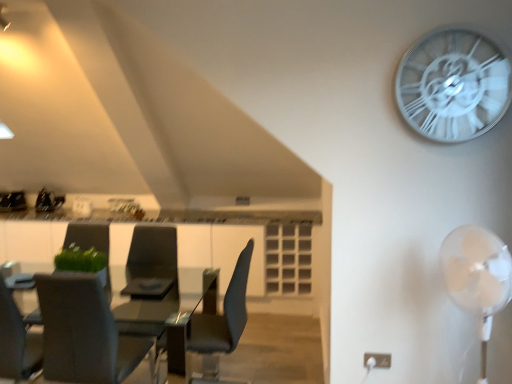
What do you see at coordinates (91, 242) in the screenshot?
I see `green fabric armchair at left, which appears as the 2th armchair when viewed from the right` at bounding box center [91, 242].

Describe the element at coordinates (221, 324) in the screenshot. The image size is (512, 384). I see `matte black chair at center, arranged as the first chair when viewed from the right` at that location.

This screenshot has width=512, height=384. Describe the element at coordinates (150, 278) in the screenshot. I see `matte black armchair at center, positioned as the first armchair in right-to-left order` at that location.

This screenshot has width=512, height=384. Describe the element at coordinates (84, 332) in the screenshot. I see `matte gray chair at left, which appears as the first chair when viewed from the left` at that location.

Find the location of a particular element. The width and height of the screenshot is (512, 384). green fabric armchair at left, which appears as the 2th armchair when viewed from the right is located at coordinates (91, 242).

Do you think white metallic clock at upper right is within matte gray chair at left, which appears as the first chair when viewed from the left, or outside of it?

white metallic clock at upper right cannot be found inside matte gray chair at left, which appears as the first chair when viewed from the left.

Does point (452, 62) come farther from viewer compared to point (116, 373)?

No, (452, 62) is in front of (116, 373).

Would you say white metallic clock at upper right is to the left or to the right of matte gray chair at left, the 2th chair in the right-to-left sequence, in the picture?

From the image, it's evident that white metallic clock at upper right is to the right of matte gray chair at left, the 2th chair in the right-to-left sequence.

Which of these two, white metallic clock at upper right or matte gray chair at left, the 2th chair in the right-to-left sequence, is thinner?

Thinner between the two is white metallic clock at upper right.

Is green fabric armchair at left, which appears as the 2th armchair when viewed from the right, far from matte black armchair at center, positioned as the first armchair in right-to-left order?

green fabric armchair at left, which appears as the 2th armchair when viewed from the right, is near matte black armchair at center, positioned as the first armchair in right-to-left order, not far away.

Is green fabric armchair at left, which appears as the 2th armchair when viewed from the right, outside of matte black armchair at center, positioned as the first armchair in right-to-left order?

Absolutely, green fabric armchair at left, which appears as the 2th armchair when viewed from the right, is external to matte black armchair at center, positioned as the first armchair in right-to-left order.

Which is more to the left, green fabric armchair at left, which appears as the 2th armchair when viewed from the right, or matte black armchair at center, which is the 2th armchair from left to right?

green fabric armchair at left, which appears as the 2th armchair when viewed from the right, is more to the left.

Which of these two, matte black chair at center, arranged as the first chair when viewed from the right, or green fabric armchair at left, which appears as the 2th armchair when viewed from the right, is thinner?

green fabric armchair at left, which appears as the 2th armchair when viewed from the right, is thinner.

From their relative heights in the image, would you say matte black chair at center, marked as the second chair in a left-to-right arrangement, is taller or shorter than green fabric armchair at left, the first armchair from the left?

In the image, matte black chair at center, marked as the second chair in a left-to-right arrangement, appears to be taller than green fabric armchair at left, the first armchair from the left.

How far apart are matte black chair at center, marked as the second chair in a left-to-right arrangement, and green fabric armchair at left, the first armchair from the left?

matte black chair at center, marked as the second chair in a left-to-right arrangement, is 1.04 meters from green fabric armchair at left, the first armchair from the left.

How many degrees apart are the facing directions of matte black chair at center, marked as the second chair in a left-to-right arrangement, and green fabric armchair at left, the first armchair from the left?

83.1 degrees separate the facing orientations of matte black chair at center, marked as the second chair in a left-to-right arrangement, and green fabric armchair at left, the first armchair from the left.

Considering the relative positions of white plastic fan at right and matte black chair at center, arranged as the first chair when viewed from the right, in the image provided, is white plastic fan at right to the left of matte black chair at center, arranged as the first chair when viewed from the right, from the viewer's perspective?

No.

Considering the relative sizes of white plastic fan at right and matte black chair at center, marked as the second chair in a left-to-right arrangement, in the image provided, is white plastic fan at right smaller than matte black chair at center, marked as the second chair in a left-to-right arrangement,?

Yes.

From the image's perspective, relative to matte black chair at center, arranged as the first chair when viewed from the right, is white plastic fan at right above or below?

Clearly, from the image's perspective, white plastic fan at right is above matte black chair at center, arranged as the first chair when viewed from the right.

Which is more distant, (174, 252) or (493, 259)?

The point (174, 252) is behind.

Is matte black armchair at center, which is the 2th armchair from left to right, not within white plastic fan at right?

Yes, matte black armchair at center, which is the 2th armchair from left to right, is outside of white plastic fan at right.

Relative to white plastic fan at right, is matte black armchair at center, positioned as the first armchair in right-to-left order, in front or behind?

In the image, matte black armchair at center, positioned as the first armchair in right-to-left order, appears behind white plastic fan at right.

Considering the relative sizes of white metallic clock at upper right and matte black chair at center, marked as the second chair in a left-to-right arrangement, in the image provided, is white metallic clock at upper right wider than matte black chair at center, marked as the second chair in a left-to-right arrangement,?

In fact, white metallic clock at upper right might be narrower than matte black chair at center, marked as the second chair in a left-to-right arrangement.

Between point (420, 53) and point (202, 365), which one is positioned in front?

The point (420, 53) is closer.

From a real-world perspective, is white metallic clock at upper right on matte black chair at center, marked as the second chair in a left-to-right arrangement?

Yes, from a real-world perspective, white metallic clock at upper right is on top of matte black chair at center, marked as the second chair in a left-to-right arrangement.

Looking at this image, in terms of size, does white metallic clock at upper right appear bigger or smaller than matte black chair at center, marked as the second chair in a left-to-right arrangement?

white metallic clock at upper right is smaller than matte black chair at center, marked as the second chair in a left-to-right arrangement.

Does matte black armchair at center, which is the 2th armchair from left to right, touch matte gray chair at left, which appears as the first chair when viewed from the left?

No, matte black armchair at center, which is the 2th armchair from left to right, is not making contact with matte gray chair at left, which appears as the first chair when viewed from the left.

Is point (123, 311) positioned after point (129, 338)?

Yes, point (123, 311) is farther from viewer.

Looking at this image, how different are the orientations of matte black armchair at center, which is the 2th armchair from left to right, and matte gray chair at left, the 2th chair in the right-to-left sequence, in degrees?

matte black armchair at center, which is the 2th armchair from left to right, and matte gray chair at left, the 2th chair in the right-to-left sequence, are facing 177 degrees away from each other.

From the image's perspective, would you say matte black armchair at center, which is the 2th armchair from left to right, is shown under matte gray chair at left, the 2th chair in the right-to-left sequence?

No, from the image's perspective, matte black armchair at center, which is the 2th armchair from left to right, is not below matte gray chair at left, the 2th chair in the right-to-left sequence.

This screenshot has width=512, height=384. In order to click on wall clock that is on the right side of matte gray chair at left, the 2th chair in the right-to-left sequence in this screenshot , I will do `click(453, 85)`.

Locate an element on the screen. armchair lying in front of the matte black armchair at center, positioned as the first armchair in right-to-left order is located at coordinates (91, 242).

When comparing their distances from matte black armchair at center, positioned as the first armchair in right-to-left order, does matte black chair at center, arranged as the first chair when viewed from the right, or matte gray chair at left, the 2th chair in the right-to-left sequence, seem further?

matte black chair at center, arranged as the first chair when viewed from the right.

Based on their spatial positions, is green fabric armchair at left, the first armchair from the left, or white plastic fan at right closer to white metallic clock at upper right?

white plastic fan at right.

Considering their positions, is white plastic fan at right positioned closer to matte black chair at center, arranged as the first chair when viewed from the right, than white metallic clock at upper right?

white plastic fan at right is closer to matte black chair at center, arranged as the first chair when viewed from the right.

Estimate the real-world distances between objects in this image. Which object is further from white metallic clock at upper right, white plastic fan at right or matte black chair at center, arranged as the first chair when viewed from the right?

matte black chair at center, arranged as the first chair when viewed from the right, is further to white metallic clock at upper right.

Based on their spatial positions, is green fabric armchair at left, the first armchair from the left, or white metallic clock at upper right further from matte black chair at center, marked as the second chair in a left-to-right arrangement?

white metallic clock at upper right lies further to matte black chair at center, marked as the second chair in a left-to-right arrangement, than the other object.

From the image, which object appears to be farther from matte black chair at center, marked as the second chair in a left-to-right arrangement, white metallic clock at upper right or matte gray chair at left, the 2th chair in the right-to-left sequence?

white metallic clock at upper right.

Estimate the real-world distances between objects in this image. Which object is further from matte black chair at center, arranged as the first chair when viewed from the right, green fabric armchair at left, the first armchair from the left, or white plastic fan at right?

white plastic fan at right.

Estimate the real-world distances between objects in this image. Which object is closer to white plastic fan at right, matte gray chair at left, the 2th chair in the right-to-left sequence, or matte black chair at center, marked as the second chair in a left-to-right arrangement?

matte black chair at center, marked as the second chair in a left-to-right arrangement, is positioned closer to the anchor white plastic fan at right.

Identify the location of wall clock located between matte black armchair at center, which is the 2th armchair from left to right, and white plastic fan at right in the left-right direction. [x=453, y=85].

The width and height of the screenshot is (512, 384). I want to click on armchair located between matte gray chair at left, the 2th chair in the right-to-left sequence, and matte black armchair at center, which is the 2th armchair from left to right, in the depth direction, so click(91, 242).

Identify the location of armchair located between matte gray chair at left, the 2th chair in the right-to-left sequence, and white plastic fan at right in the left-right direction. (150, 278).

Identify the location of armchair between matte gray chair at left, the 2th chair in the right-to-left sequence, and matte black chair at center, marked as the second chair in a left-to-right arrangement, from left to right. This screenshot has height=384, width=512. (150, 278).